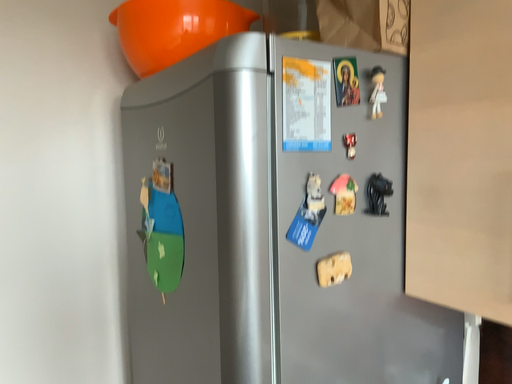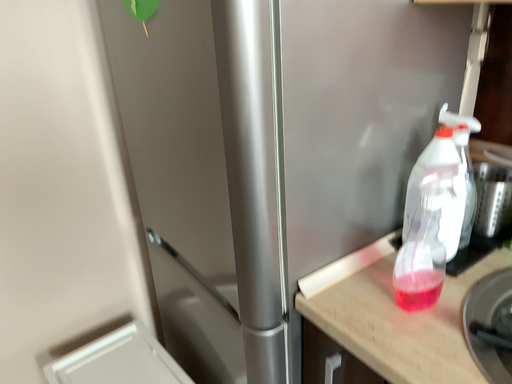
Question: Which way did the camera rotate in the video?

Choices:
 (A) rotated downward
 (B) rotated upward

Answer: (A)